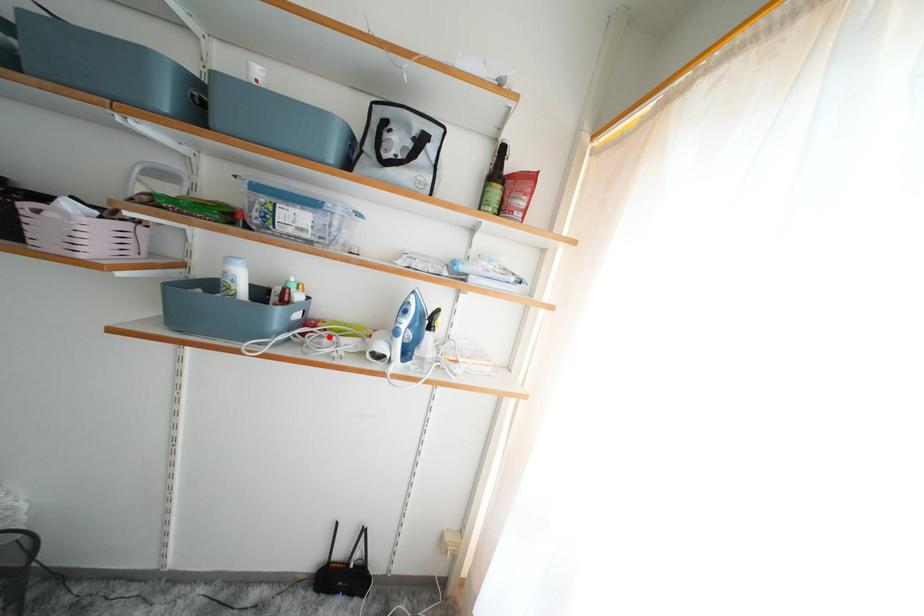
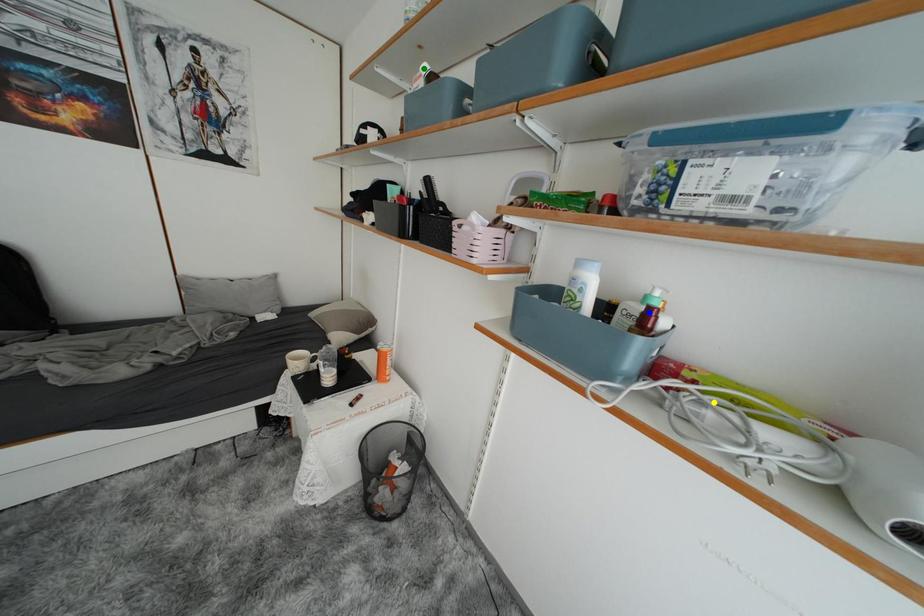
Question: I am providing you with two images of the same scene from different viewpoints. A red point is marked on the first image. You are given multiple points on the second image. Can you choose the point in image 2 that corresponds to the point in image 1?

Choices:
 (A) green point
 (B) yellow point
 (C) blue point

Answer: (B)